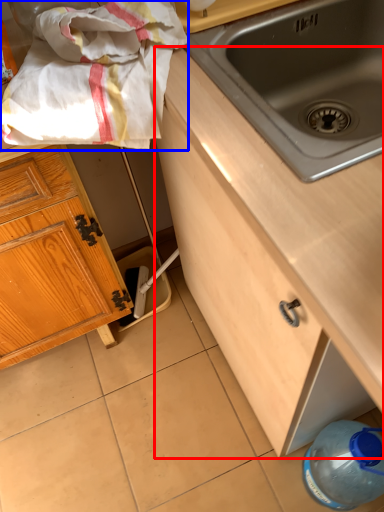
Question: Which object is further to the camera taking this photo, cabinetry (highlighted by a red box) or blanket (highlighted by a blue box)?

Choices:
 (A) cabinetry
 (B) blanket

Answer: (B)